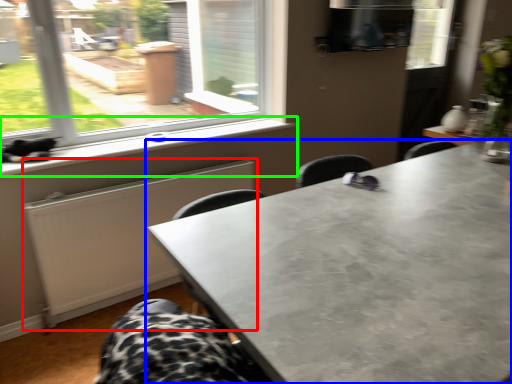
Question: Estimate the real-world distances between objects in this image. Which object is farther from radiator (highlighted by a red box), table (highlighted by a blue box) or window sill (highlighted by a green box)?

Choices:
 (A) table
 (B) window sill

Answer: (A)